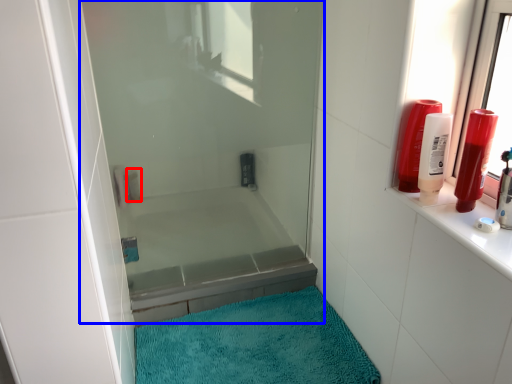
Question: Which point is closer to the camera, toiletry (highlighted by a red box) or shower door (highlighted by a blue box)?

Choices:
 (A) toiletry
 (B) shower door

Answer: (B)